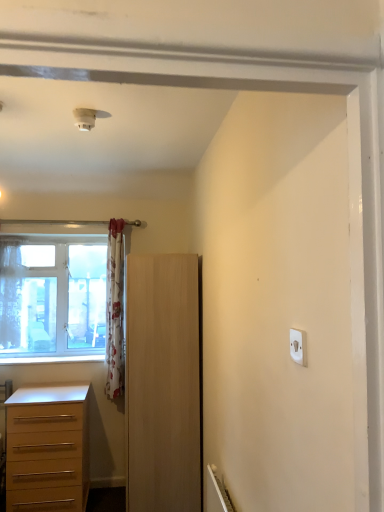
Question: Does white plastic light switch at upper right have a greater width compared to clear glass window at left?

Choices:
 (A) no
 (B) yes

Answer: (A)

Question: From the image's perspective, is white plastic light switch at upper right above clear glass window at left?

Choices:
 (A) no
 (B) yes

Answer: (B)

Question: Is white plastic light switch at upper right in front of clear glass window at left?

Choices:
 (A) yes
 (B) no

Answer: (A)

Question: Is white plastic light switch at upper right in contact with clear glass window at left?

Choices:
 (A) no
 (B) yes

Answer: (A)

Question: Is white plastic light switch at upper right smaller than clear glass window at left?

Choices:
 (A) no
 (B) yes

Answer: (B)

Question: Considering the positions of white plastic light switch at upper right and floral fabric curtain at left, arranged as the second curtain when viewed from the left, in the image, is white plastic light switch at upper right taller or shorter than floral fabric curtain at left, arranged as the second curtain when viewed from the left,?

Choices:
 (A) short
 (B) tall

Answer: (A)

Question: From a real-world perspective, relative to floral fabric curtain at left, which is the 1th curtain in right-to-left order, is white plastic light switch at upper right vertically above or below?

Choices:
 (A) below
 (B) above

Answer: (B)

Question: In terms of width, does white plastic light switch at upper right look wider or thinner when compared to floral fabric curtain at left, which is the 1th curtain in right-to-left order?

Choices:
 (A) thin
 (B) wide

Answer: (A)

Question: Based on their positions, is white plastic light switch at upper right located to the left or right of floral fabric curtain at left, arranged as the second curtain when viewed from the left?

Choices:
 (A) right
 (B) left

Answer: (A)

Question: From a real-world perspective, is sheer floral fabric curtain at left, which ranks as the 2th curtain in right-to-left order, physically located above or below light brown wooden chest of drawers at lower left?

Choices:
 (A) below
 (B) above

Answer: (B)

Question: Choose the correct answer: Is sheer floral fabric curtain at left, arranged as the first curtain when viewed from the left, inside light brown wooden chest of drawers at lower left or outside it?

Choices:
 (A) outside
 (B) inside

Answer: (A)

Question: In the image, is sheer floral fabric curtain at left, which ranks as the 2th curtain in right-to-left order, positioned in front of or behind light brown wooden chest of drawers at lower left?

Choices:
 (A) behind
 (B) front

Answer: (A)

Question: Is sheer floral fabric curtain at left, which ranks as the 2th curtain in right-to-left order, taller or shorter than light brown wooden chest of drawers at lower left?

Choices:
 (A) short
 (B) tall

Answer: (B)

Question: From a real-world perspective, is floral fabric curtain at left, which is the 1th curtain in right-to-left order, physically located above or below light brown wooden chest of drawers at lower left?

Choices:
 (A) below
 (B) above

Answer: (B)

Question: Considering the positions of point (120, 272) and point (39, 396), is point (120, 272) closer or farther from the camera than point (39, 396)?

Choices:
 (A) closer
 (B) farther

Answer: (B)